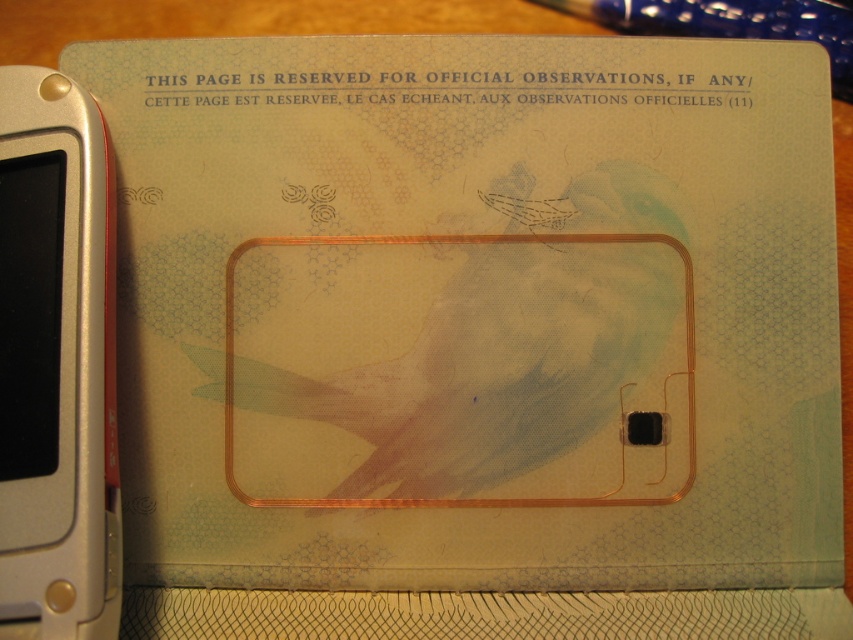
You are designing a layout for a new passport page and need to place the silver metallic smartphone at left and the transparent plastic pen at upper center. Based on their sizes, which object should be placed closer to the edge to ensure they don not overlap?

The silver metallic smartphone at left has a lesser width compared to the transparent plastic pen at upper center, so placing the silver metallic smartphone at left closer to the edge would prevent overlapping since it is narrower.

You are designing a layout for an official document and need to place the silver metallic smartphone at left and the transparent plastic pen at upper center. Based on their sizes, which object should you consider placing first to ensure proper spacing?

The silver metallic smartphone at left should be placed first since it occupies less space than the transparent plastic pen at upper center, allowing for better spacing adjustments around the larger pen.

You are holding a silver metallic smartphone at left and want to place it on the passport page shown. Based on the image description, where should you place it so that it aligns with the center of the page?

The silver metallic smartphone at left should be placed at the center of the passport page to align with the center, but according to the description, the silver metallic smartphone at left is currently located at point (56, 362) which is not the center. To align it with the center, move it to the central area described in the scene.